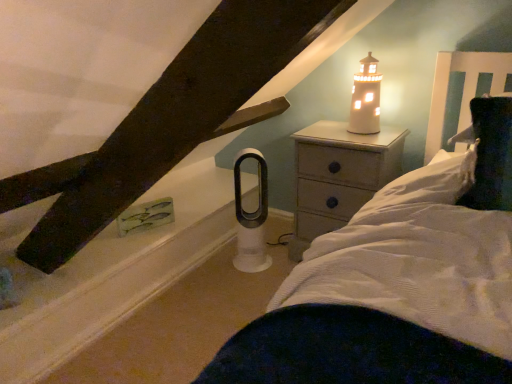
Find the location of a particular element. The height and width of the screenshot is (384, 512). free point above white matte window sill at lower left (from a real-world perspective) is located at coordinates (199, 310).